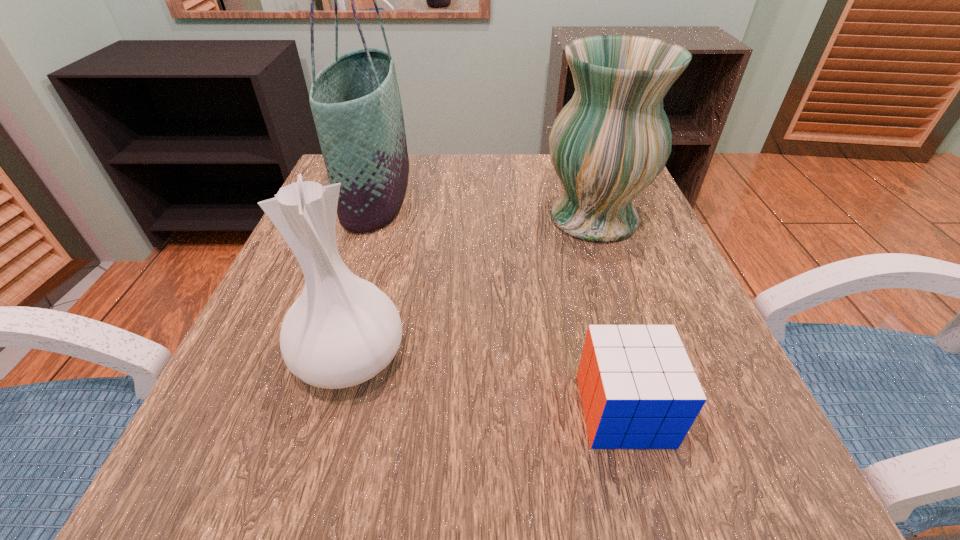
Where is `vase present at the far edge`? This screenshot has width=960, height=540. vase present at the far edge is located at coordinates (612, 139).

This screenshot has height=540, width=960. What are the coordinates of `object positioned at the near edge` in the screenshot? It's located at (638, 389).

The image size is (960, 540). What are the coordinates of `tote bag that is at the left edge` in the screenshot? It's located at (355, 101).

Locate an element on the screen. This screenshot has width=960, height=540. vase that is at the left edge is located at coordinates (342, 330).

Image resolution: width=960 pixels, height=540 pixels. I want to click on vase at the right edge, so click(x=612, y=139).

The height and width of the screenshot is (540, 960). I want to click on cube that is at the right edge, so click(638, 389).

This screenshot has height=540, width=960. Find the location of `object situated at the far left corner`. object situated at the far left corner is located at coordinates (355, 101).

Locate an element on the screen. The width and height of the screenshot is (960, 540). object located at the far right corner is located at coordinates (612, 139).

Image resolution: width=960 pixels, height=540 pixels. Identify the location of object that is at the near right corner. (638, 389).

Locate an element on the screen. The image size is (960, 540). vacant space at the far edge of the desktop is located at coordinates (478, 194).